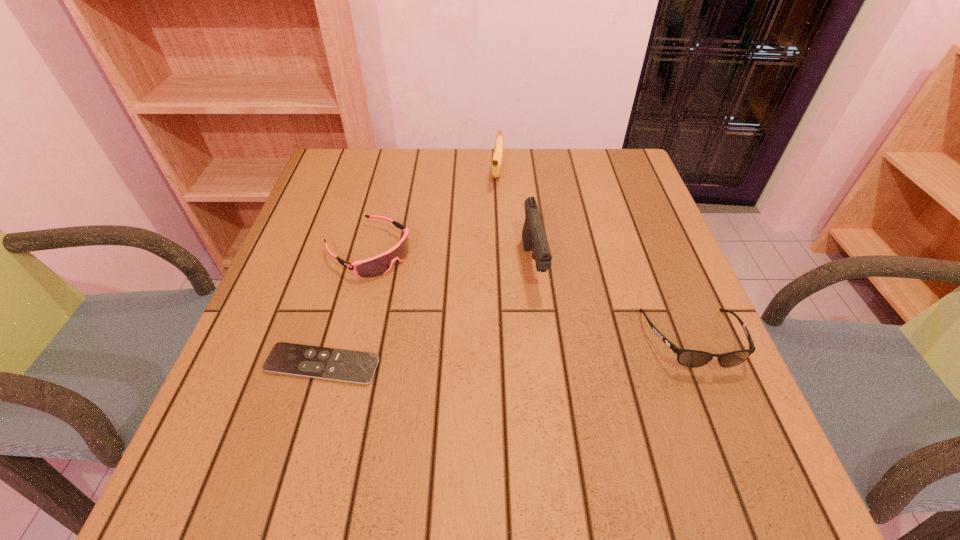
The width and height of the screenshot is (960, 540). Identify the location of object that ranks as the second closest to the rightmost object. (496, 166).

You are a GUI agent. You are given a task and a screenshot of the screen. Output one action in this format:
    pyautogui.click(x=<x>, y=<y>)
    Task: Click on the vacant space that satisfies the following two spatial constraints: 1. on the back side of the shortest object; 2. on the right side of the second object from right to left
    The image size is (960, 540).
    Given the screenshot: What is the action you would take?
    pyautogui.click(x=351, y=266)

Find the location of a particular element. The height and width of the screenshot is (540, 960). free space that satisfies the following two spatial constraints: 1. on the back side of the banana; 2. on the left side of the goggles is located at coordinates (389, 172).